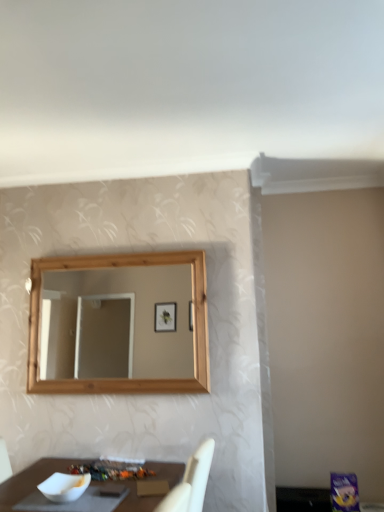
Question: Would you say white glossy bowl at lower left is a long distance from white matte bowl at lower left?

Choices:
 (A) yes
 (B) no

Answer: (B)

Question: Is white glossy bowl at lower left facing away from white matte bowl at lower left?

Choices:
 (A) yes
 (B) no

Answer: (B)

Question: Does white glossy bowl at lower left have a lesser height compared to white matte bowl at lower left?

Choices:
 (A) no
 (B) yes

Answer: (B)

Question: Does white glossy bowl at lower left have a lesser width compared to white matte bowl at lower left?

Choices:
 (A) yes
 (B) no

Answer: (B)

Question: Can you confirm if white glossy bowl at lower left is smaller than white matte bowl at lower left?

Choices:
 (A) yes
 (B) no

Answer: (A)

Question: Is white glossy bowl at lower left facing towards white matte bowl at lower left?

Choices:
 (A) no
 (B) yes

Answer: (B)

Question: From the image's perspective, is white matte bowl at lower left over white glossy bowl at lower left?

Choices:
 (A) yes
 (B) no

Answer: (A)

Question: Would you say white matte bowl at lower left contains white glossy bowl at lower left?

Choices:
 (A) no
 (B) yes

Answer: (A)

Question: Considering the relative positions of white matte bowl at lower left and white glossy bowl at lower left in the image provided, is white matte bowl at lower left to the right of white glossy bowl at lower left from the viewer's perspective?

Choices:
 (A) no
 (B) yes

Answer: (A)

Question: Can you confirm if white matte bowl at lower left is wider than white glossy bowl at lower left?

Choices:
 (A) yes
 (B) no

Answer: (B)

Question: Is white matte bowl at lower left aimed at white glossy bowl at lower left?

Choices:
 (A) yes
 (B) no

Answer: (B)

Question: From the image's perspective, does white matte bowl at lower left appear lower than white glossy bowl at lower left?

Choices:
 (A) yes
 (B) no

Answer: (B)

Question: From a real-world perspective, is white glossy bowl at lower left physically located above or below white matte bowl at lower left?

Choices:
 (A) below
 (B) above

Answer: (A)